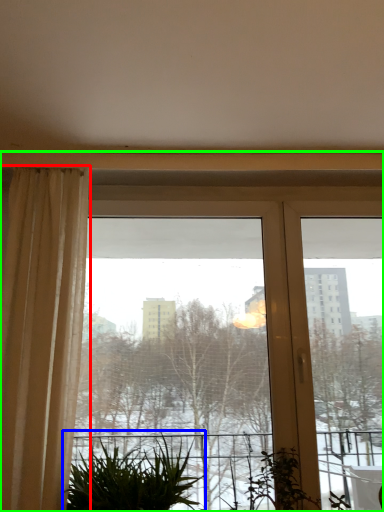
Question: Estimate the real-world distances between objects in this image. Which object is closer to curtain (highlighted by a red box), houseplant (highlighted by a blue box) or window (highlighted by a green box)?

Choices:
 (A) houseplant
 (B) window

Answer: (A)